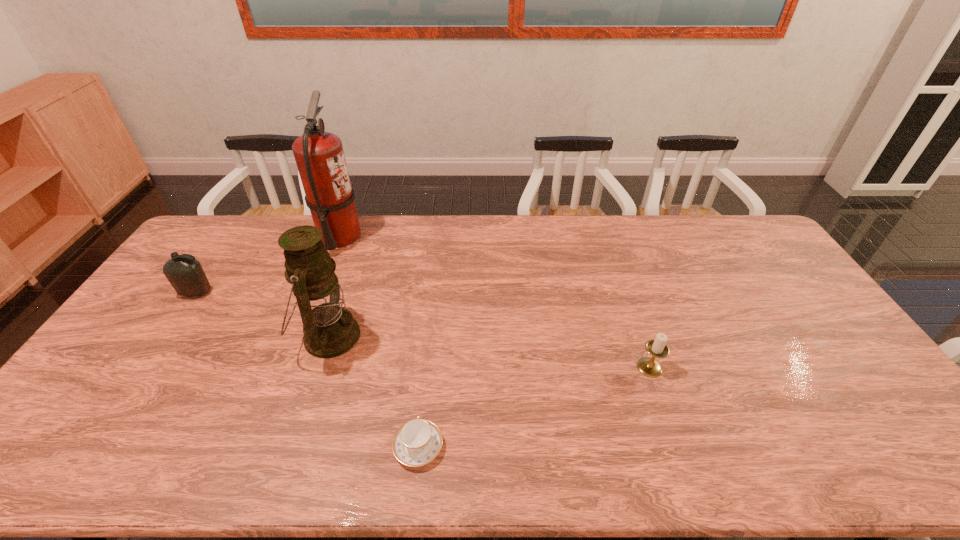
Identify the location of fire extinguisher. (319, 155).

Find the location of a particular element. Image resolution: width=960 pixels, height=540 pixels. the tallest object is located at coordinates (319, 155).

You are a GUI agent. You are given a task and a screenshot of the screen. Output one action in this format:
    pyautogui.click(x=<x>, y=<y>)
    Task: Click on the oil lamp
    Image resolution: width=960 pixels, height=540 pixels.
    Given the screenshot: What is the action you would take?
    pyautogui.click(x=330, y=330)

The image size is (960, 540). In order to click on the third tallest object in this screenshot , I will do `click(186, 275)`.

In order to click on the leftmost object in this screenshot , I will do 186,275.

You are a GUI agent. You are given a task and a screenshot of the screen. Output one action in this format:
    pyautogui.click(x=<x>, y=<y>)
    Task: Click on the rightmost object
    The width and height of the screenshot is (960, 540).
    Given the screenshot: What is the action you would take?
    pyautogui.click(x=657, y=347)

Find the location of a particular element. This screenshot has width=960, height=540. the second shortest object is located at coordinates (657, 347).

Where is `the nearest object`? The width and height of the screenshot is (960, 540). the nearest object is located at coordinates [416, 443].

I want to click on the shortest object, so click(x=416, y=443).

At what (x,y) coordinates should I click in order to perform the action: click on free space located toward the nozzle of the fire extinguisher. Please return your answer as a coordinate pair (x, y). Looking at the image, I should click on (396, 237).